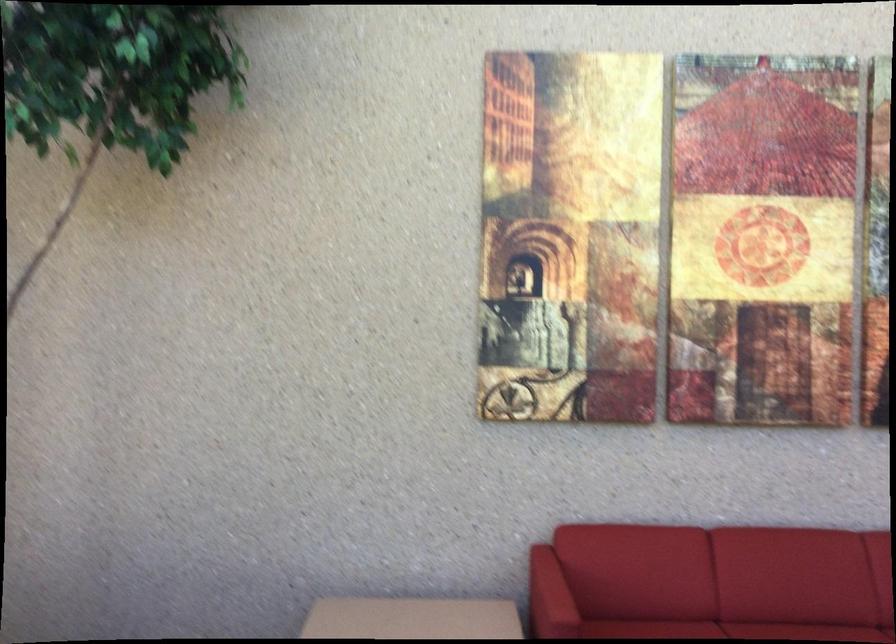
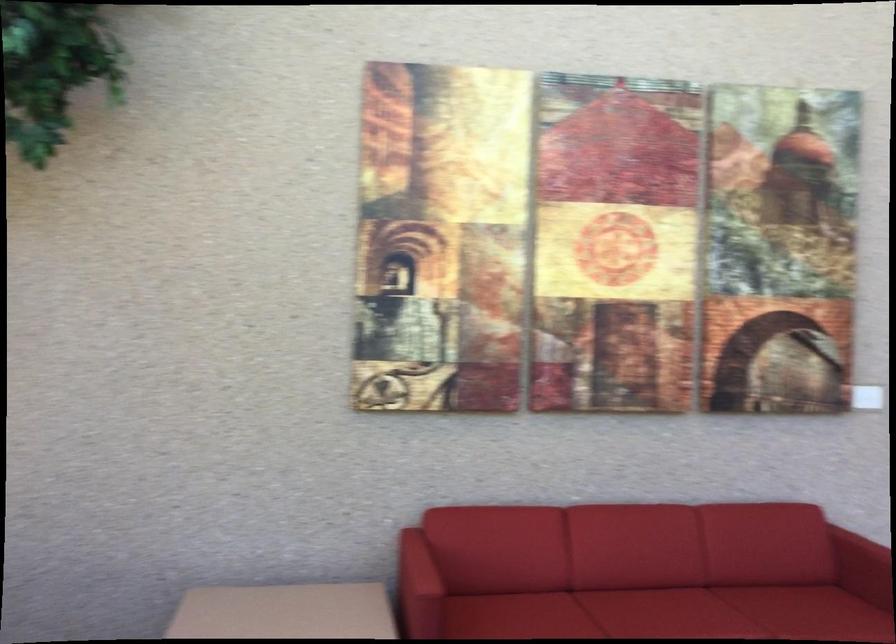
Question: The camera is either moving clockwise (left) or counter-clockwise (right) around the object. The first image is from the beginning of the video and the second image is from the end. Is the camera moving left or right when shooting the video?

Choices:
 (A) Left
 (B) Right

Answer: (A)